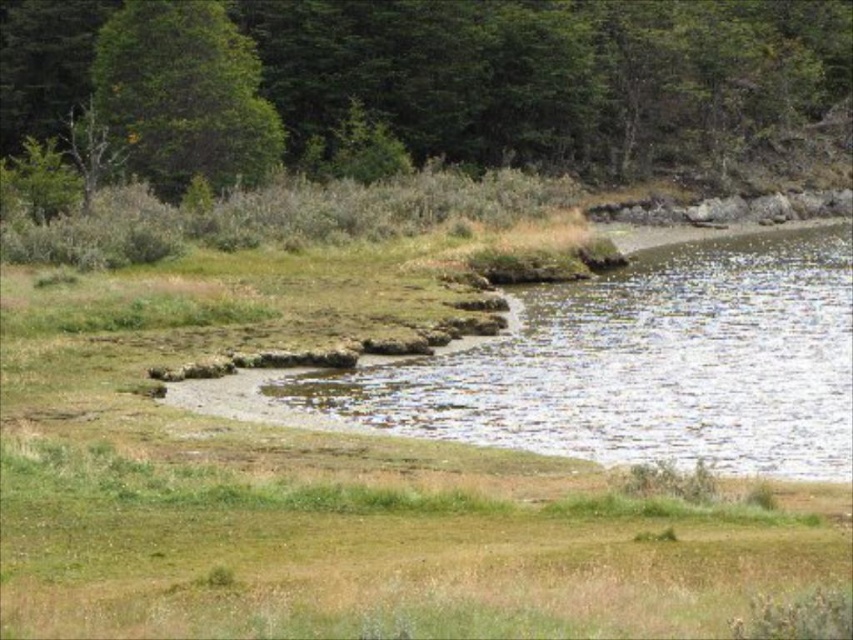
Is point (618, 289) farther from viewer compared to point (257, 132)?

No, it is not.

Find the location of a particular element. This screenshot has height=640, width=853. clear water at lower right is located at coordinates (643, 364).

Between green leafy tree at upper center and green leafy tree at upper left, which one has less height?

Standing shorter between the two is green leafy tree at upper left.

Is point (282, 113) closer to viewer compared to point (136, 113)?

That is False.

At what (x,y) coordinates should I click in order to perform the action: click on green leafy tree at upper center. Please return your answer as a coordinate pair (x, y). The height and width of the screenshot is (640, 853). Looking at the image, I should click on (553, 74).

The image size is (853, 640). I want to click on green leafy tree at upper center, so click(x=553, y=74).

Does green leafy tree at upper center have a larger size compared to clear water at lower right?

Yes.

Describe the element at coordinates (553, 74) in the screenshot. I see `green leafy tree at upper center` at that location.

The width and height of the screenshot is (853, 640). What are the coordinates of `green leafy tree at upper center` in the screenshot? It's located at (553, 74).